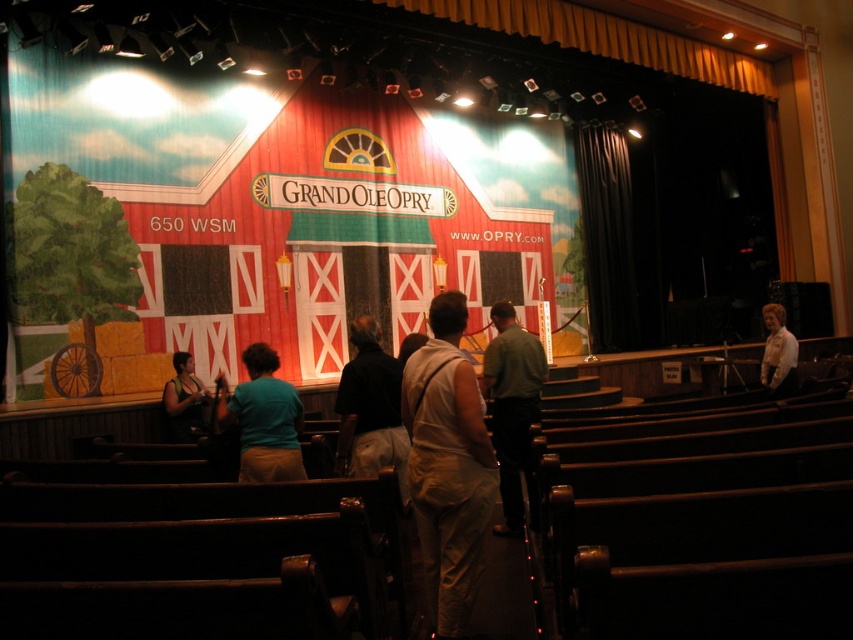
Which is above, black velvet curtain at right or white shirt at right?

Positioned higher is black velvet curtain at right.

Is black velvet curtain at right positioned at the back of white shirt at right?

Yes, it is behind white shirt at right.

This screenshot has height=640, width=853. In order to click on black velvet curtain at right in this screenshot , I will do `click(606, 237)`.

Is matte black dress at center smaller than white shirt at right?

Correct, matte black dress at center occupies less space than white shirt at right.

Does matte black dress at center appear on the right side of white shirt at right?

In fact, matte black dress at center is to the left of white shirt at right.

Who is more distant from viewer, (184, 400) or (775, 324)?

Positioned behind is point (775, 324).

Locate an element on the screen. The height and width of the screenshot is (640, 853). matte black dress at center is located at coordinates (184, 400).

Does beige fabric dress at center appear on the right side of matte black dress at center?

Indeed, beige fabric dress at center is positioned on the right side of matte black dress at center.

What do you see at coordinates (447, 465) in the screenshot? The width and height of the screenshot is (853, 640). I see `beige fabric dress at center` at bounding box center [447, 465].

Who is more distant from viewer, (432, 612) or (186, 362)?

The point (186, 362) is behind.

This screenshot has height=640, width=853. I want to click on beige fabric dress at center, so click(447, 465).